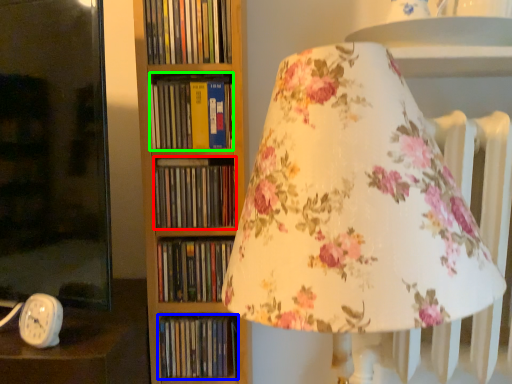
Question: Considering the real-world distances, which object is farthest from book (highlighted by a red box)? book (highlighted by a blue box) or book (highlighted by a green box)?

Choices:
 (A) book
 (B) book

Answer: (A)